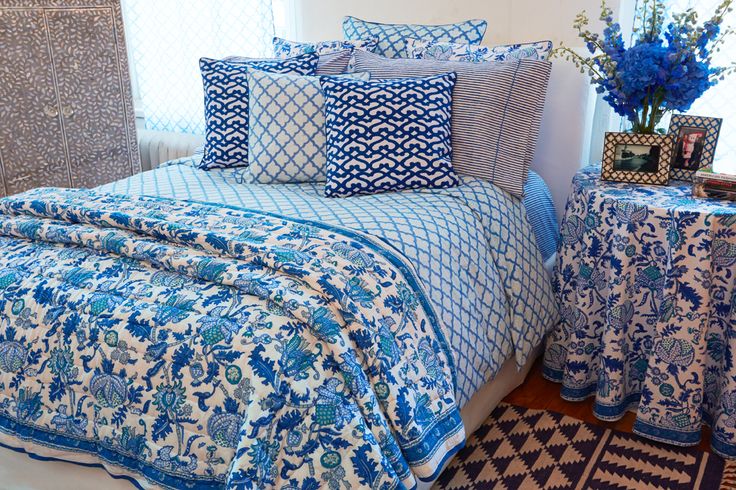
This screenshot has height=490, width=736. What are the coordinates of `partitian` in the screenshot? It's located at (62, 129).